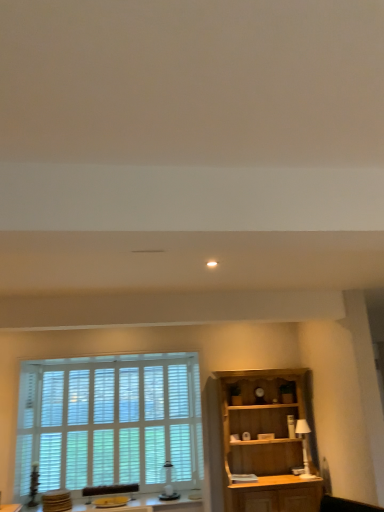
Question: Is white wood blinds at left at the left side of white glossy lamp at right?

Choices:
 (A) no
 (B) yes

Answer: (B)

Question: Considering the relative sizes of white wood blinds at left and white glossy lamp at right in the image provided, is white wood blinds at left smaller than white glossy lamp at right?

Choices:
 (A) no
 (B) yes

Answer: (A)

Question: From the image's perspective, is white wood blinds at left located above white glossy lamp at right?

Choices:
 (A) no
 (B) yes

Answer: (B)

Question: From a real-world perspective, is white wood blinds at left on top of white glossy lamp at right?

Choices:
 (A) no
 (B) yes

Answer: (B)

Question: Considering the relative positions of white wood blinds at left and white glossy lamp at right in the image provided, is white wood blinds at left behind white glossy lamp at right?

Choices:
 (A) no
 (B) yes

Answer: (A)

Question: Based on their sizes in the image, would you say white glossy lamp at right is bigger or smaller than white wood blinds at left?

Choices:
 (A) small
 (B) big

Answer: (A)

Question: Considering the positions of point (306, 473) and point (135, 474), is point (306, 473) closer or farther from the camera than point (135, 474)?

Choices:
 (A) closer
 (B) farther

Answer: (A)

Question: Is white glossy lamp at right taller or shorter than white wood blinds at left?

Choices:
 (A) tall
 (B) short

Answer: (B)

Question: Relative to white wood blinds at left, is white glossy lamp at right in front or behind?

Choices:
 (A) behind
 (B) front

Answer: (A)

Question: Considering the positions of white wood blinds at left and white glossy lamp at right in the image, is white wood blinds at left taller or shorter than white glossy lamp at right?

Choices:
 (A) short
 (B) tall

Answer: (B)

Question: From the image's perspective, is white wood blinds at left above or below white glossy lamp at right?

Choices:
 (A) below
 (B) above

Answer: (B)

Question: From a real-world perspective, is white wood blinds at left above or below white glossy lamp at right?

Choices:
 (A) above
 (B) below

Answer: (A)

Question: Choose the correct answer: Is white wood blinds at left inside white glossy lamp at right or outside it?

Choices:
 (A) inside
 (B) outside

Answer: (B)

Question: Is point (299, 479) closer or farther from the camera than point (139, 458)?

Choices:
 (A) closer
 (B) farther

Answer: (A)

Question: Which is correct: wooden cabinet at lower right is inside white wood blinds at left, or outside of it?

Choices:
 (A) outside
 (B) inside

Answer: (A)